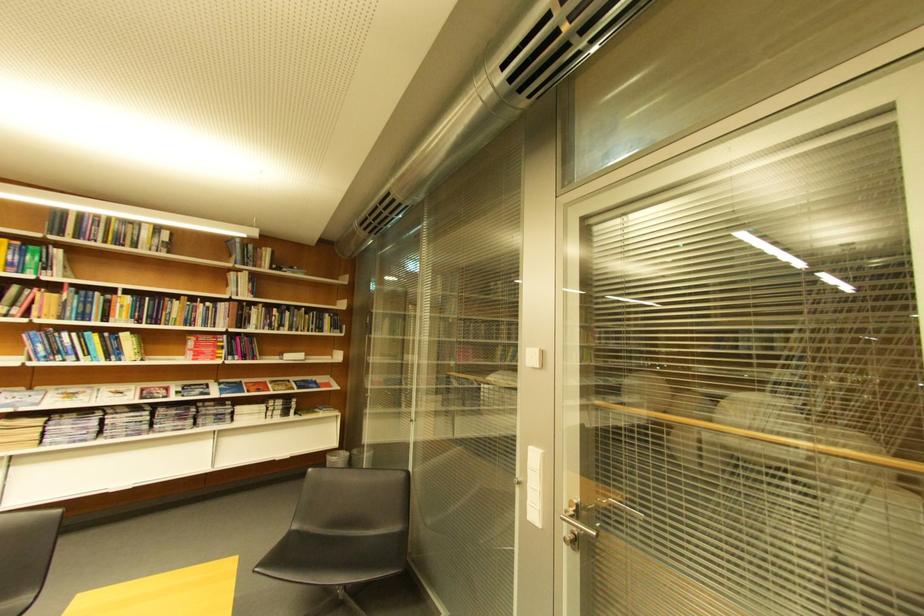
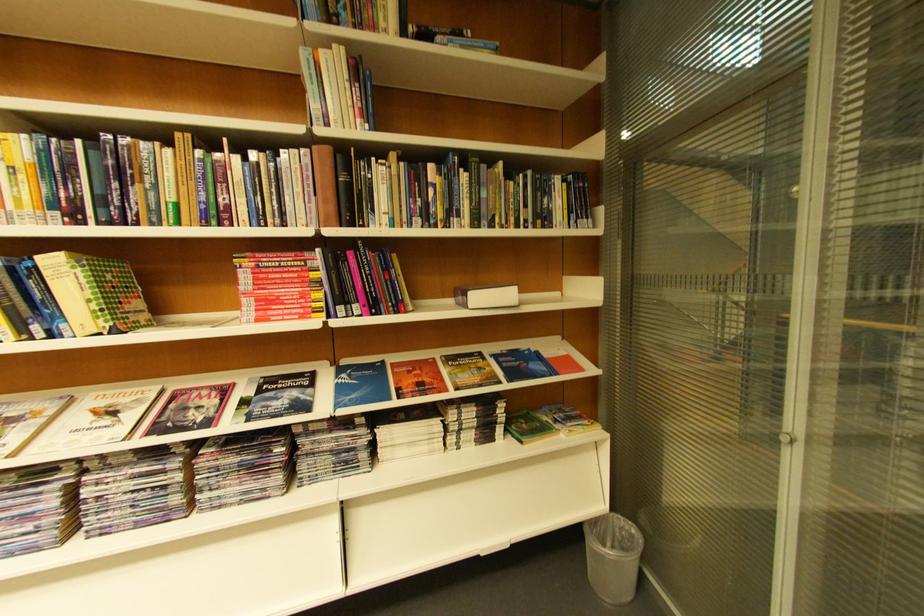
Where in the second image is the point corresponding to the point at 171,389 from the first image?

(224, 389)